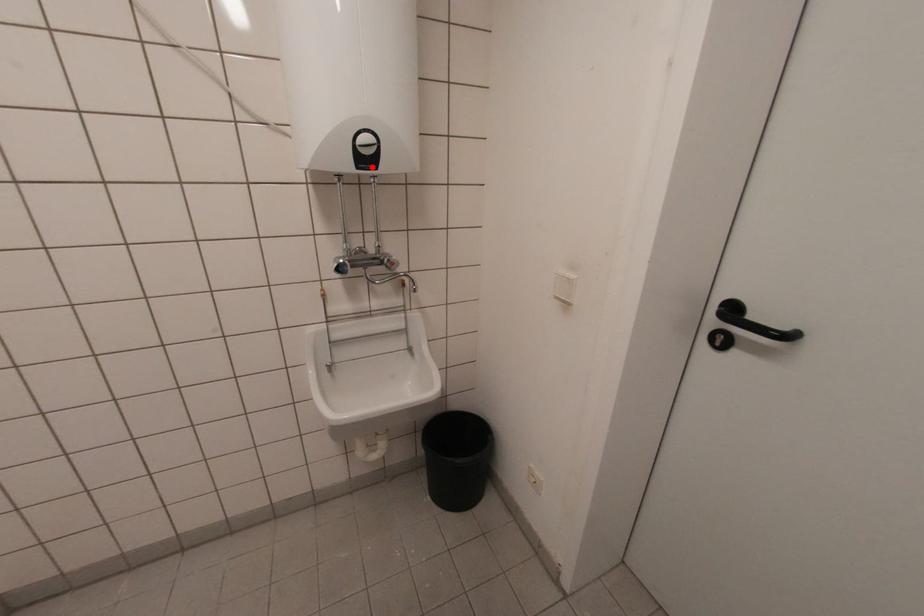
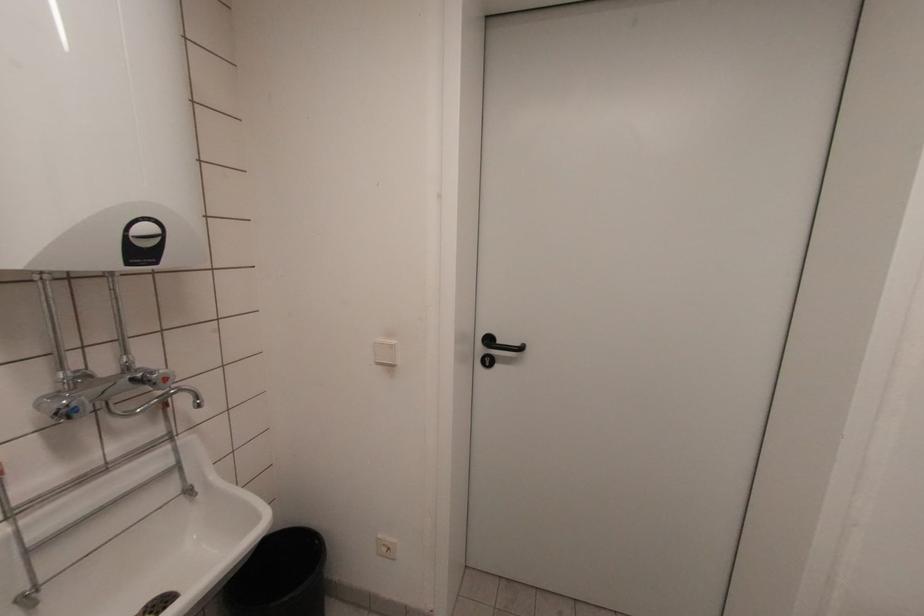
Where in the second image is the point corresponding to the highlighted location from the first image?

(151, 261)